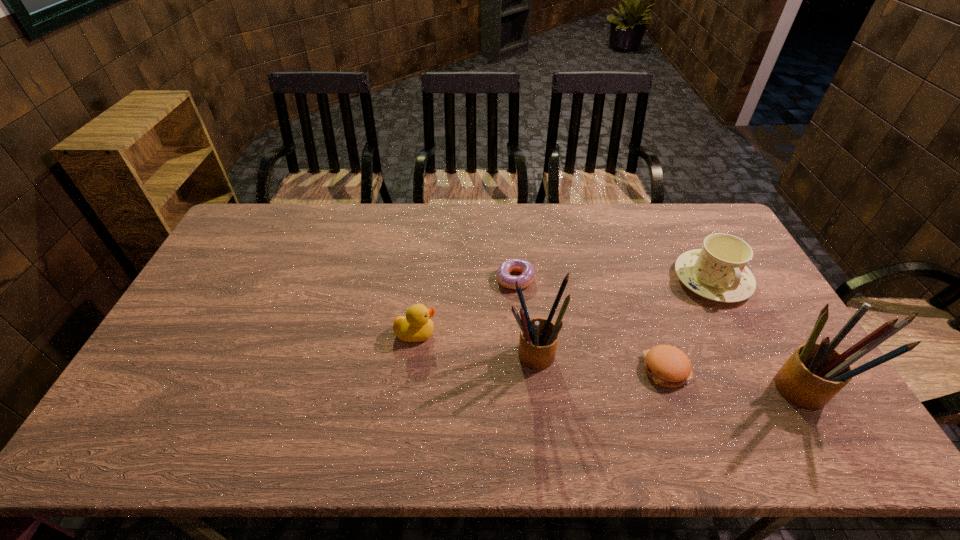
The image size is (960, 540). I want to click on vacant space at the far edge, so click(618, 218).

Where is `free space at the near edge`? The height and width of the screenshot is (540, 960). free space at the near edge is located at coordinates (227, 409).

Where is `blank space at the left edge of the desktop`? This screenshot has height=540, width=960. blank space at the left edge of the desktop is located at coordinates (234, 292).

In the image, there is a desktop. Where is `blank space at the right edge`? The width and height of the screenshot is (960, 540). blank space at the right edge is located at coordinates (767, 346).

Find the location of a particular element. The image size is (960, 540). vacant space at the far left corner is located at coordinates (277, 228).

Locate an element on the screen. free space at the far right corner is located at coordinates (676, 215).

The height and width of the screenshot is (540, 960). I want to click on free spot between the doughnut and the leftmost object, so click(x=466, y=306).

You are a GUI agent. You are given a task and a screenshot of the screen. Output one action in this format:
    pyautogui.click(x=<x>, y=<y>)
    Task: Click on the vacant space that is in between the left pencil box and the fourth object from left to right
    
    Given the screenshot: What is the action you would take?
    pyautogui.click(x=599, y=362)

You are a GUI agent. You are given a task and a screenshot of the screen. Output one action in this format:
    pyautogui.click(x=<x>, y=<y>)
    Task: Click on the vacant area that lies between the right pencil box and the duckling
    
    Given the screenshot: What is the action you would take?
    pyautogui.click(x=608, y=361)

The width and height of the screenshot is (960, 540). Find the location of `vacant space in between the patty and the shorter pencil box`. vacant space in between the patty and the shorter pencil box is located at coordinates (599, 362).